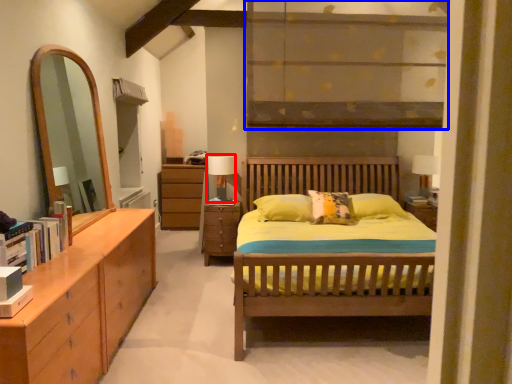
Question: Which of the following is the farthest to the observer, table lamp (highlighted by a red box) or shelf (highlighted by a blue box)?

Choices:
 (A) table lamp
 (B) shelf

Answer: (A)